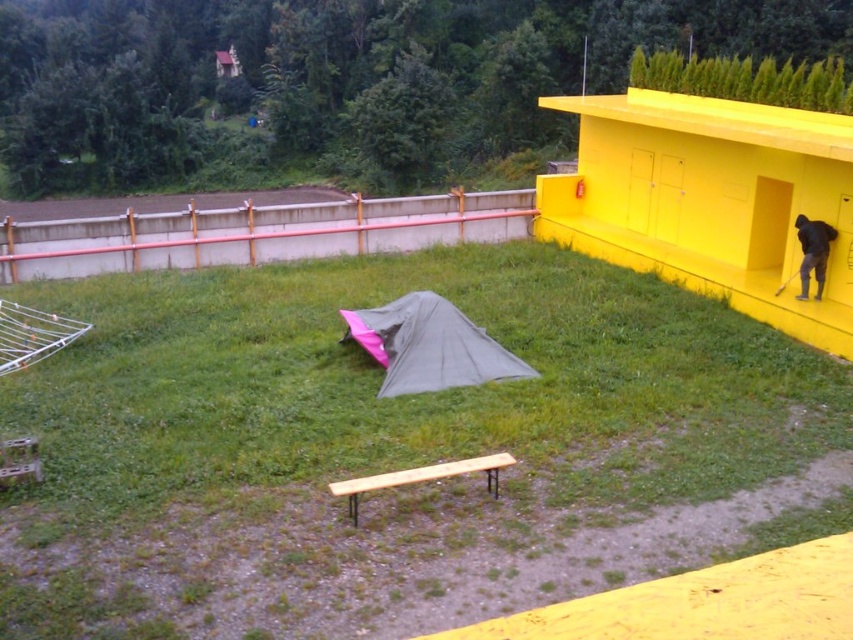
Is green grassy at center to the right of dark gray fabric at right from the viewer's perspective?

In fact, green grassy at center is to the left of dark gray fabric at right.

Who is more distant from viewer, (625,298) or (807,292)?

Positioned behind is point (625,298).

Between point (88, 403) and point (825, 253), which one is positioned in front?

Point (88, 403) is in front.

Where is `green grassy at center`? This screenshot has width=853, height=640. green grassy at center is located at coordinates (407, 396).